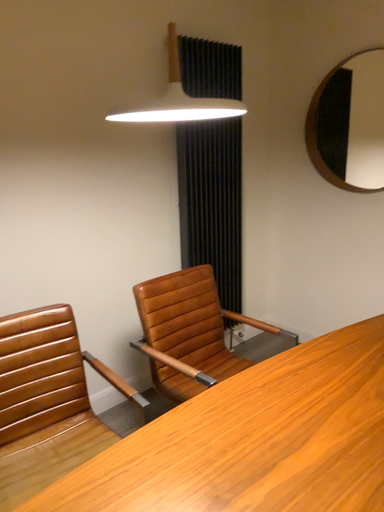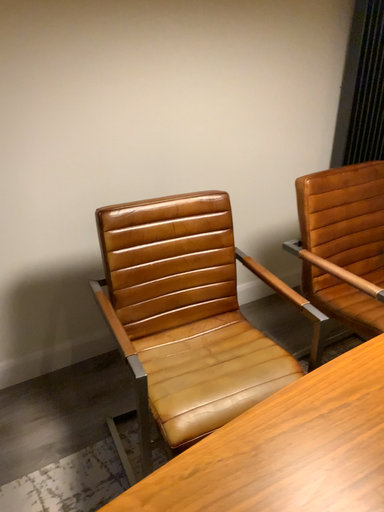
Question: Which way did the camera rotate in the video?

Choices:
 (A) rotated upward
 (B) rotated downward

Answer: (B)